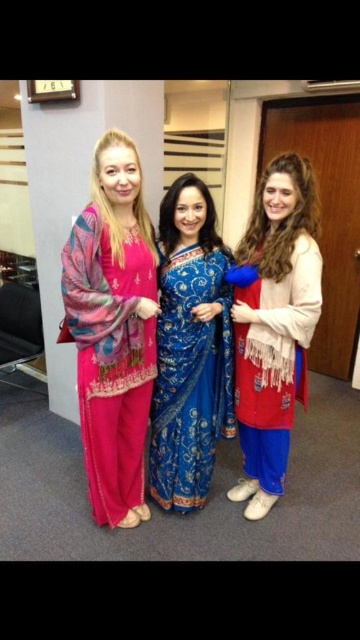
Measure the distance between point (141, 496) and camera.

2.28 meters

Locate an element on the screen. Image resolution: width=360 pixels, height=640 pixels. pink embroidered dress at left is located at coordinates (113, 330).

Locate an element on the screen. The width and height of the screenshot is (360, 640). pink embroidered dress at left is located at coordinates (113, 330).

Can you confirm if pink embroidered dress at left is taller than matte red dress at right?

Indeed, pink embroidered dress at left has a greater height compared to matte red dress at right.

Can you confirm if pink embroidered dress at left is bigger than matte red dress at right?

Correct, pink embroidered dress at left is larger in size than matte red dress at right.

What do you see at coordinates (113, 330) in the screenshot? I see `pink embroidered dress at left` at bounding box center [113, 330].

What are the coordinates of `pink embroidered dress at left` in the screenshot? It's located at (113, 330).

Which is in front, point (285, 256) or point (182, 262)?

Positioned in front is point (285, 256).

Between matte red dress at right and blue silk saree at center, which one has less height?

blue silk saree at center

Which is in front, point (300, 273) or point (155, 464)?

Point (300, 273) is in front.

The width and height of the screenshot is (360, 640). What are the coordinates of `matte red dress at right` in the screenshot? It's located at (275, 324).